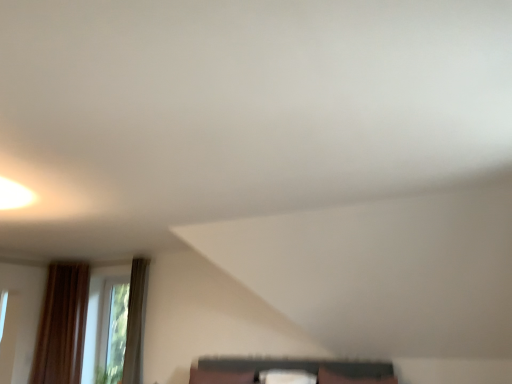
Describe the element at coordinates (220, 377) in the screenshot. I see `brown fabric pillow at lower center, acting as the 2th pillow starting from the right` at that location.

The image size is (512, 384). What do you see at coordinates (113, 331) in the screenshot?
I see `transparent glass window at lower left` at bounding box center [113, 331].

In order to face white fabric pillow at center, the 1th pillow in the right-to-left sequence, should I rotate leftwards or rightwards?

You should rotate right by 4.202 degrees.

This screenshot has width=512, height=384. I want to click on brown fabric pillow at lower center, acting as the 2th pillow starting from the right, so click(220, 377).

Considering the relative sizes of brown fabric pillow at lower center, acting as the 2th pillow starting from the right, and matte black shelf at lower center in the image provided, is brown fabric pillow at lower center, acting as the 2th pillow starting from the right, shorter than matte black shelf at lower center?

No, brown fabric pillow at lower center, acting as the 2th pillow starting from the right, is not shorter than matte black shelf at lower center.

Is brown fabric pillow at lower center, which ranks as the 1th pillow in left-to-right order, facing away from matte black shelf at lower center?

brown fabric pillow at lower center, which ranks as the 1th pillow in left-to-right order, is not turned away from matte black shelf at lower center.

Which pillow is the 2nd one when counting from the back of the matte black shelf at lower center? Please provide its 2D coordinates.

[(220, 377)]

Consider the image. From a real-world perspective, is matte black shelf at lower center on brown fabric pillow at lower center, acting as the 2th pillow starting from the right?

Yes, from a real-world perspective, matte black shelf at lower center is on top of brown fabric pillow at lower center, acting as the 2th pillow starting from the right.

Which object is further away from the camera, matte black shelf at lower center or brown fabric pillow at lower center, acting as the 2th pillow starting from the right?

Positioned behind is brown fabric pillow at lower center, acting as the 2th pillow starting from the right.

From the picture: Is matte black shelf at lower center aimed at brown fabric pillow at lower center, which ranks as the 1th pillow in left-to-right order?

No.

Considering the sizes of objects matte black shelf at lower center and brown fabric pillow at lower center, which ranks as the 1th pillow in left-to-right order, in the image provided, who is shorter, matte black shelf at lower center or brown fabric pillow at lower center, which ranks as the 1th pillow in left-to-right order,?

With less height is matte black shelf at lower center.

Does transparent glass window at lower left turn towards white fabric pillow at center, the 2th pillow positioned from the left?

No, transparent glass window at lower left is not aimed at white fabric pillow at center, the 2th pillow positioned from the left.

Which object is positioned more to the right, transparent glass window at lower left or white fabric pillow at center, the 1th pillow in the right-to-left sequence?

white fabric pillow at center, the 1th pillow in the right-to-left sequence.

In the image, is transparent glass window at lower left positioned in front of or behind white fabric pillow at center, the 1th pillow in the right-to-left sequence?

In the image, transparent glass window at lower left appears behind white fabric pillow at center, the 1th pillow in the right-to-left sequence.

From a real-world perspective, which pillow is the 2nd one underneath the transparent glass window at lower left? Please provide its 2D coordinates.

[(286, 377)]

Considering the relative sizes of white fabric pillow at center, the 1th pillow in the right-to-left sequence, and matte black shelf at lower center in the image provided, is white fabric pillow at center, the 1th pillow in the right-to-left sequence, bigger than matte black shelf at lower center?

Actually, white fabric pillow at center, the 1th pillow in the right-to-left sequence, might be smaller than matte black shelf at lower center.

Considering the positions of objects white fabric pillow at center, the 1th pillow in the right-to-left sequence, and matte black shelf at lower center in the image provided, who is more to the left, white fabric pillow at center, the 1th pillow in the right-to-left sequence, or matte black shelf at lower center?

From the viewer's perspective, white fabric pillow at center, the 1th pillow in the right-to-left sequence, appears more on the left side.

Considering the relative sizes of white fabric pillow at center, the 1th pillow in the right-to-left sequence, and matte black shelf at lower center in the image provided, is white fabric pillow at center, the 1th pillow in the right-to-left sequence, shorter than matte black shelf at lower center?

Indeed, white fabric pillow at center, the 1th pillow in the right-to-left sequence, has a lesser height compared to matte black shelf at lower center.

Measure the distance from white fabric pillow at center, the 1th pillow in the right-to-left sequence, to matte black shelf at lower center.

A distance of 13.71 inches exists between white fabric pillow at center, the 1th pillow in the right-to-left sequence, and matte black shelf at lower center.

Is brown fabric pillow at lower center, which ranks as the 1th pillow in left-to-right order, looking in the opposite direction of transparent glass window at lower left?

No, brown fabric pillow at lower center, which ranks as the 1th pillow in left-to-right order, is not facing away from transparent glass window at lower left.

Could you measure the distance between brown fabric pillow at lower center, acting as the 2th pillow starting from the right, and transparent glass window at lower left?

The distance of brown fabric pillow at lower center, acting as the 2th pillow starting from the right, from transparent glass window at lower left is 1.61 meters.

Is brown fabric pillow at lower center, acting as the 2th pillow starting from the right, far from transparent glass window at lower left?

Yes.

Does matte black shelf at lower center have a lesser width compared to transparent glass window at lower left?

Incorrect, the width of matte black shelf at lower center is not less than that of transparent glass window at lower left.

Considering the positions of objects matte black shelf at lower center and transparent glass window at lower left in the image provided, who is behind, matte black shelf at lower center or transparent glass window at lower left?

transparent glass window at lower left.

Locate an element on the screen. The image size is (512, 384). window above the matte black shelf at lower center (from a real-world perspective) is located at coordinates (113, 331).

From the image's perspective, who appears lower, matte black shelf at lower center or transparent glass window at lower left?

From the image's view, transparent glass window at lower left is below.

The width and height of the screenshot is (512, 384). What are the coordinates of `pillow that is in front of the brown fabric pillow at lower center, acting as the 2th pillow starting from the right` in the screenshot? It's located at (286, 377).

Is white fabric pillow at center, the 1th pillow in the right-to-left sequence, positioned with its back to brown fabric pillow at lower center, which ranks as the 1th pillow in left-to-right order?

white fabric pillow at center, the 1th pillow in the right-to-left sequence, does not have its back to brown fabric pillow at lower center, which ranks as the 1th pillow in left-to-right order.

From a real-world perspective, is white fabric pillow at center, the 1th pillow in the right-to-left sequence, over brown fabric pillow at lower center, which ranks as the 1th pillow in left-to-right order?

Incorrect, from a real-world perspective, white fabric pillow at center, the 1th pillow in the right-to-left sequence, is lower than brown fabric pillow at lower center, which ranks as the 1th pillow in left-to-right order.

Is point (295, 375) closer to camera compared to point (205, 381)?

Yes.

This screenshot has width=512, height=384. Find the location of `the 2nd pillow counting from the left side of the matte black shelf at lower center`. the 2nd pillow counting from the left side of the matte black shelf at lower center is located at coordinates (220, 377).

Locate an element on the screen. pillow that is the 2nd one when counting backward from the matte black shelf at lower center is located at coordinates (220, 377).

When comparing their distances from white fabric pillow at center, the 2th pillow positioned from the left, does brown fabric pillow at lower center, which ranks as the 1th pillow in left-to-right order, or matte black shelf at lower center seem further?

brown fabric pillow at lower center, which ranks as the 1th pillow in left-to-right order, is further to white fabric pillow at center, the 2th pillow positioned from the left.

Based on the photo, when comparing their distances from white fabric pillow at center, the 1th pillow in the right-to-left sequence, does transparent glass window at lower left or brown fabric pillow at lower center, acting as the 2th pillow starting from the right, seem further?

transparent glass window at lower left is further to white fabric pillow at center, the 1th pillow in the right-to-left sequence.

Based on the photo, considering their positions, is white fabric pillow at center, the 2th pillow positioned from the left, positioned closer to transparent glass window at lower left than matte black shelf at lower center?

white fabric pillow at center, the 2th pillow positioned from the left, is closer to transparent glass window at lower left.

Based on their spatial positions, is brown fabric pillow at lower center, which ranks as the 1th pillow in left-to-right order, or white fabric pillow at center, the 1th pillow in the right-to-left sequence, closer to transparent glass window at lower left?

brown fabric pillow at lower center, which ranks as the 1th pillow in left-to-right order, is closer to transparent glass window at lower left.

Looking at the image, which one is located further to matte black shelf at lower center, transparent glass window at lower left or brown fabric pillow at lower center, acting as the 2th pillow starting from the right?

transparent glass window at lower left is further to matte black shelf at lower center.

Looking at the image, which one is located further to brown fabric pillow at lower center, acting as the 2th pillow starting from the right, matte black shelf at lower center or transparent glass window at lower left?

transparent glass window at lower left is further to brown fabric pillow at lower center, acting as the 2th pillow starting from the right.

In the scene shown: From the image, which object appears to be nearer to transparent glass window at lower left, matte black shelf at lower center or white fabric pillow at center, the 1th pillow in the right-to-left sequence?

Among the two, white fabric pillow at center, the 1th pillow in the right-to-left sequence, is located nearer to transparent glass window at lower left.

Considering their positions, is transparent glass window at lower left positioned closer to matte black shelf at lower center than white fabric pillow at center, the 1th pillow in the right-to-left sequence?

The object closer to matte black shelf at lower center is white fabric pillow at center, the 1th pillow in the right-to-left sequence.

The width and height of the screenshot is (512, 384). I want to click on pillow between brown fabric pillow at lower center, acting as the 2th pillow starting from the right, and matte black shelf at lower center, in the horizontal direction, so [x=286, y=377].

Locate an element on the screen. pillow between transparent glass window at lower left and white fabric pillow at center, the 1th pillow in the right-to-left sequence, from left to right is located at coordinates (220, 377).